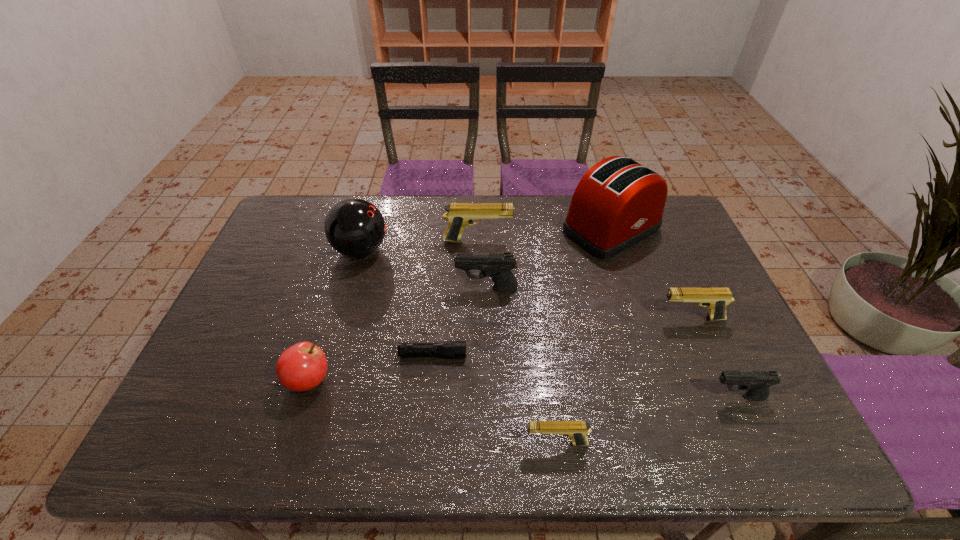
Where is `vacant space situated 0.400m at the barrel of the nearest tan pistol`? The width and height of the screenshot is (960, 540). vacant space situated 0.400m at the barrel of the nearest tan pistol is located at coordinates (341, 443).

You are a GUI agent. You are given a task and a screenshot of the screen. Output one action in this format:
    pyautogui.click(x=<x>, y=<y>)
    Task: Click on the vacant space positioned at the barrel of the nearest tan pistol
    
    Given the screenshot: What is the action you would take?
    pyautogui.click(x=401, y=443)

Where is `vacant area situated 0.140m at the barrel of the nearest tan pistol`? Image resolution: width=960 pixels, height=540 pixels. vacant area situated 0.140m at the barrel of the nearest tan pistol is located at coordinates (461, 443).

I want to click on vacant space situated 0.190m at the lens end of the shortest object, so click(540, 354).

Identify the location of toaster located in the far edge section of the desktop. click(618, 202).

Image resolution: width=960 pixels, height=540 pixels. What are the coordinates of `bowling ball at the far edge` in the screenshot? It's located at (354, 227).

This screenshot has width=960, height=540. Find the location of `pistol located at the far edge`. pistol located at the far edge is located at coordinates (459, 215).

Identify the location of object situated at the near edge. (575, 430).

What are the coordinates of `toaster situated at the right edge` in the screenshot? It's located at (618, 202).

This screenshot has height=540, width=960. I want to click on object that is at the far right corner, so click(x=618, y=202).